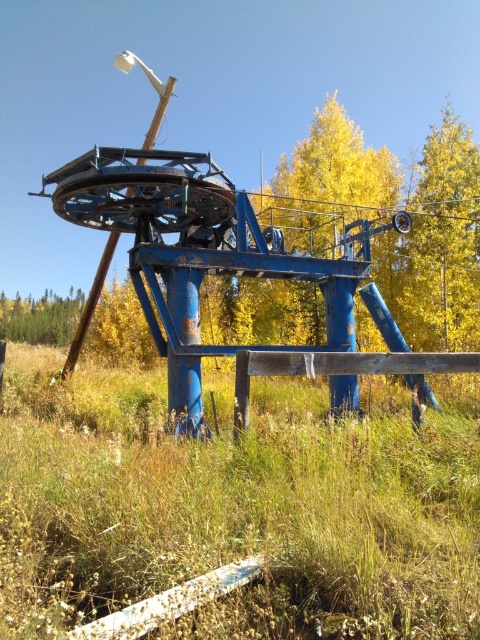
You are standing in front of the abandoned ski lift structure. There are two points marked on the structure. One is at coordinates point (394, 182) and the other at point (431, 150). Which point is closer to you?

Point (431, 150) is closer to you because it is less further to the camera than point (394, 182).

You are standing in front of the abandoned ski lift structure and want to determine which of the two points, point (347,161) or point (1,301), is nearer to you. Based on the scene, can you identify which point is closer?

Point (347,161) is closer to the viewer than point (1,301).